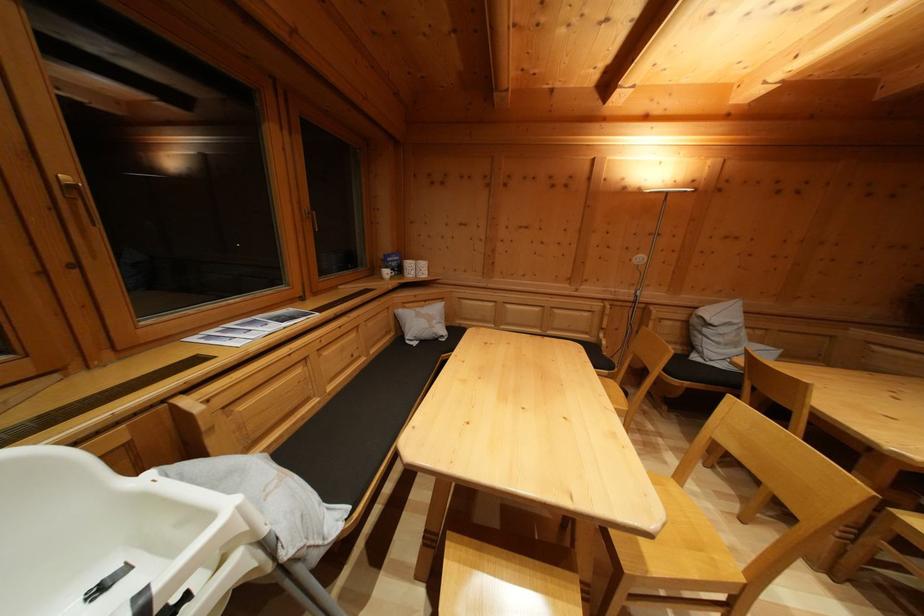
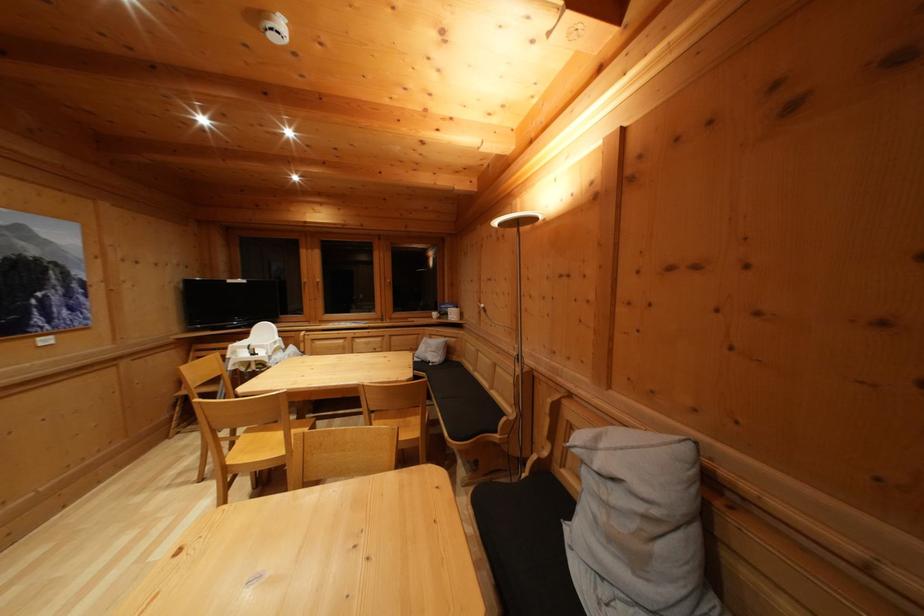
Locate, in the second image, the point that corresponds to the point at 395,262 in the first image.

(450, 310)